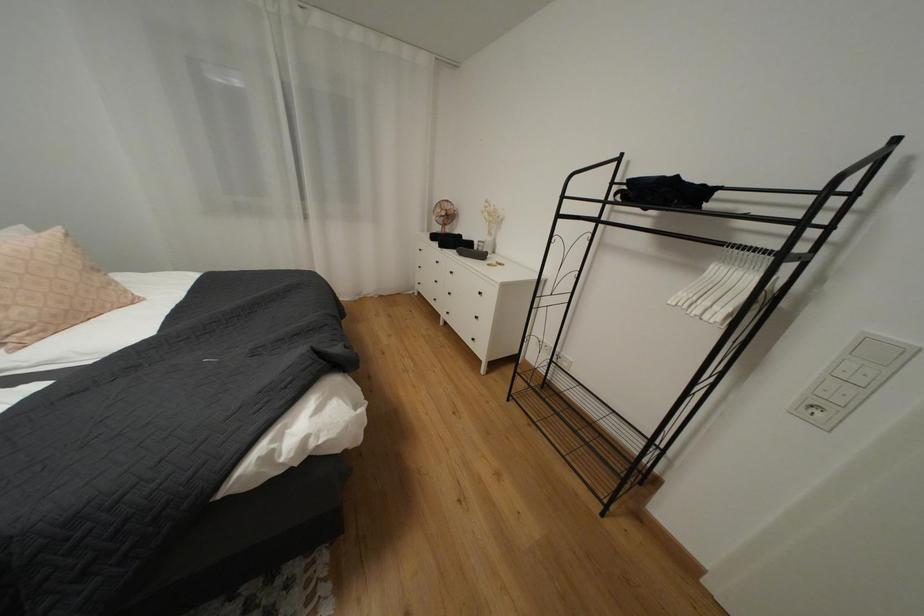
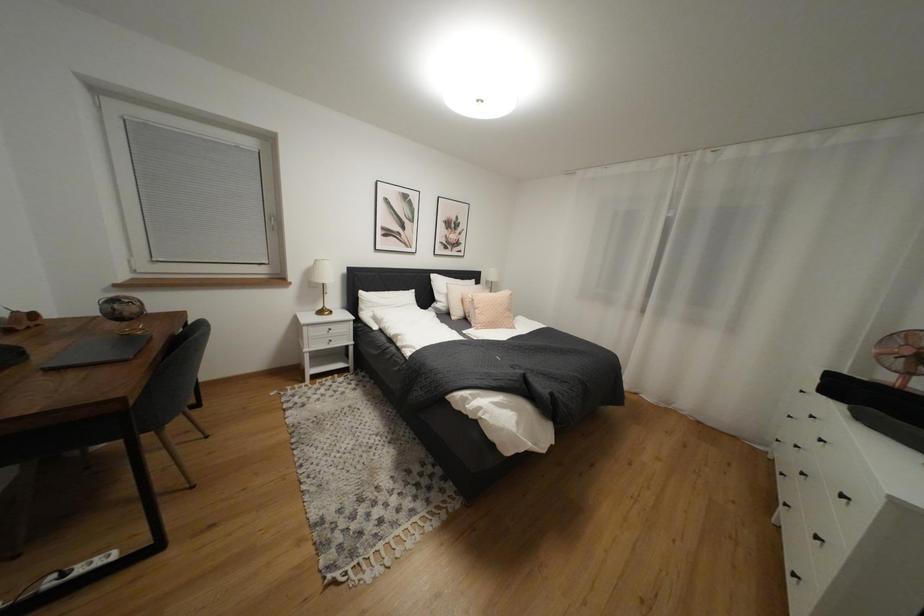
Question: The camera is either moving clockwise (left) or counter-clockwise (right) around the object. The first image is from the beginning of the video and the second image is from the end. Is the camera moving left or right when shooting the video?

Choices:
 (A) Left
 (B) Right

Answer: (B)